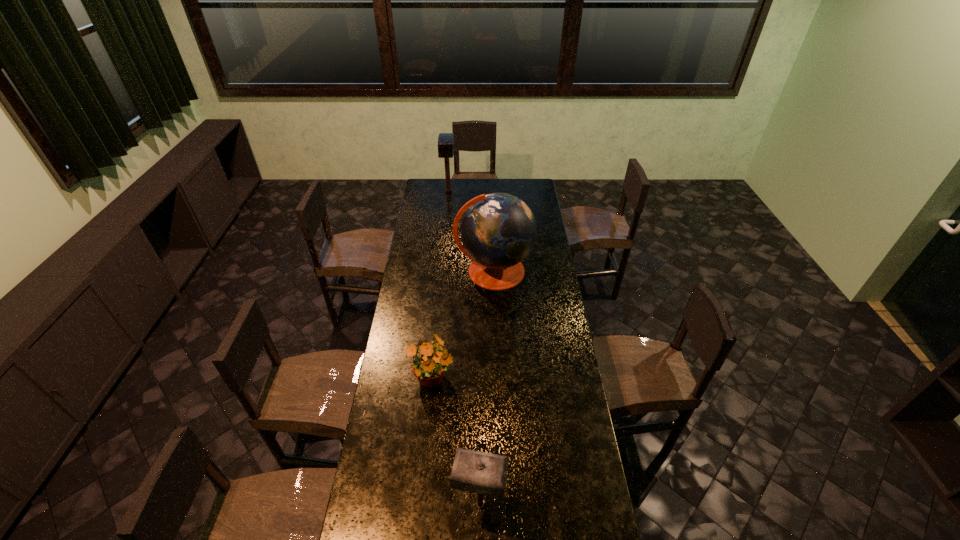
Where is `blank space at the far left corner of the desktop`? The height and width of the screenshot is (540, 960). blank space at the far left corner of the desktop is located at coordinates (430, 187).

Where is `vacant space that is in between the nearest object and the farthest object`? Image resolution: width=960 pixels, height=540 pixels. vacant space that is in between the nearest object and the farthest object is located at coordinates (465, 349).

At what (x,y) coordinates should I click in order to perform the action: click on vacant point located between the flowerpot and the second tallest object. Please return your answer as a coordinate pair (x, y). The width and height of the screenshot is (960, 540). Looking at the image, I should click on (441, 287).

This screenshot has height=540, width=960. I want to click on empty space between the flowerpot and the globe, so click(x=463, y=326).

Where is `vacant area between the shortest object and the farthest object`? vacant area between the shortest object and the farthest object is located at coordinates (441, 287).

I want to click on blank region between the third farthest object and the shorter mallet, so click(456, 443).

At what (x,y) coordinates should I click in order to perform the action: click on empty space that is in between the taller mallet and the second shortest object. Please return your answer as a coordinate pair (x, y). Image resolution: width=960 pixels, height=540 pixels. Looking at the image, I should click on (465, 349).

The height and width of the screenshot is (540, 960). What are the coordinates of `free space between the flowerpot and the right mallet` in the screenshot? It's located at (456, 443).

The width and height of the screenshot is (960, 540). Find the location of `empty space that is in between the shorter mallet and the tallest object`. empty space that is in between the shorter mallet and the tallest object is located at coordinates (487, 388).

You are a GUI agent. You are given a task and a screenshot of the screen. Output one action in this format:
    pyautogui.click(x=<x>, y=<y>)
    Task: Click on the object identified as the closest to the shortest object
    This screenshot has width=960, height=540.
    Given the screenshot: What is the action you would take?
    pyautogui.click(x=484, y=473)